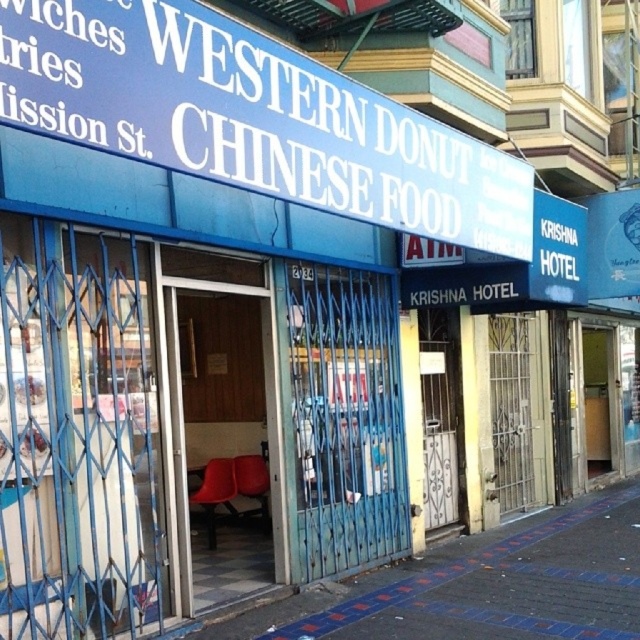
Is blue painted signboard at upper center shorter than blue tiled pavement at lower center?

In fact, blue painted signboard at upper center may be taller than blue tiled pavement at lower center.

Who is positioned more to the right, blue painted signboard at upper center or blue tiled pavement at lower center?

blue tiled pavement at lower center

Which is behind, point (38, 77) or point (545, 625)?

Point (545, 625)

The width and height of the screenshot is (640, 640). I want to click on blue painted signboard at upper center, so click(x=252, y=116).

Does blue painted signboard at upper center have a larger size compared to matte red chairs at center?

Correct, blue painted signboard at upper center is larger in size than matte red chairs at center.

Where is `blue painted signboard at upper center`? The width and height of the screenshot is (640, 640). blue painted signboard at upper center is located at coordinates (252, 116).

Which is more to the right, blue tiled pavement at lower center or matte red chairs at center?

Positioned to the right is blue tiled pavement at lower center.

Can you confirm if blue tiled pavement at lower center is smaller than matte red chairs at center?

Yes, blue tiled pavement at lower center is smaller than matte red chairs at center.

Does point (428, 595) come closer to viewer compared to point (225, 452)?

Yes.

The image size is (640, 640). In order to click on blue tiled pavement at lower center in this screenshot , I will do `click(483, 586)`.